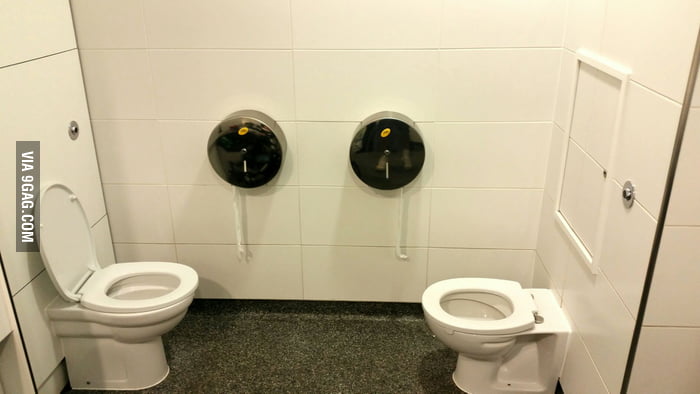
Locate an element on the screen. Image resolution: width=700 pixels, height=394 pixels. wall is located at coordinates (80, 152), (148, 123), (635, 233), (666, 254).